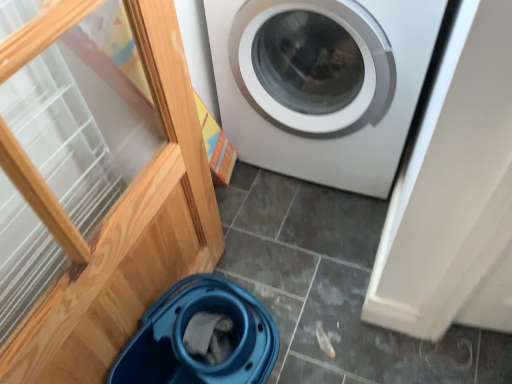
Question: Considering the positions of point (217, 84) and point (181, 365), is point (217, 84) closer or farther from the camera than point (181, 365)?

Choices:
 (A) farther
 (B) closer

Answer: (A)

Question: Relative to blue plastic bucket at lower left, is white glossy washing machine at center in front or behind?

Choices:
 (A) behind
 (B) front

Answer: (A)

Question: Looking at their shapes, would you say white glossy washing machine at center is wider or thinner than blue plastic bucket at lower left?

Choices:
 (A) thin
 (B) wide

Answer: (B)

Question: From their relative heights in the image, would you say blue plastic bucket at lower left is taller or shorter than white glossy washing machine at center?

Choices:
 (A) short
 (B) tall

Answer: (A)

Question: Is point (206, 317) positioned closer to the camera than point (414, 26)?

Choices:
 (A) closer
 (B) farther

Answer: (B)

Question: Considering their positions, is blue plastic bucket at lower left located in front of or behind white glossy washing machine at center?

Choices:
 (A) front
 (B) behind

Answer: (A)

Question: From a real-world perspective, is blue plastic bucket at lower left positioned above or below white glossy washing machine at center?

Choices:
 (A) below
 (B) above

Answer: (A)